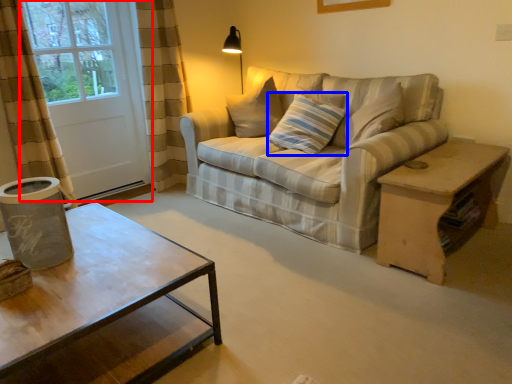
Question: Which of the following is the closest to the observer, screen door (highlighted by a red box) or pillow (highlighted by a blue box)?

Choices:
 (A) screen door
 (B) pillow

Answer: (B)